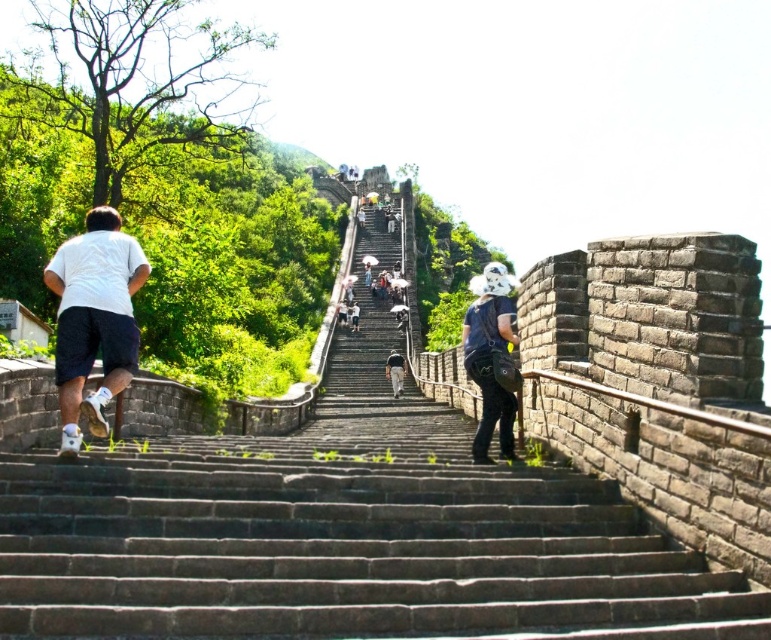
You are standing at the base of the Great Wall and see two points marked on the wall. The first point is at coordinates point (61, 250) and the second point is at point (490, 342). Which point is closer to you?

Point (61, 250) is closer to the viewer than point (490, 342).

You are standing at the bottom of the Great Wall stairs and see the white matte shorts at left and the dark blue denim overalls at center. Which person is higher up the stairs?

The white matte shorts at left is above the dark blue denim overalls at center, so the person wearing white matte shorts at left is higher up the stairs.

You are standing on the dark gray stone stairs at center and want to see the dark blue denim overalls at center. Which direction should you look to see it?

The dark gray stone stairs at center is in front of the dark blue denim overalls at center, so you should look behind you to see the dark blue denim overalls at center.